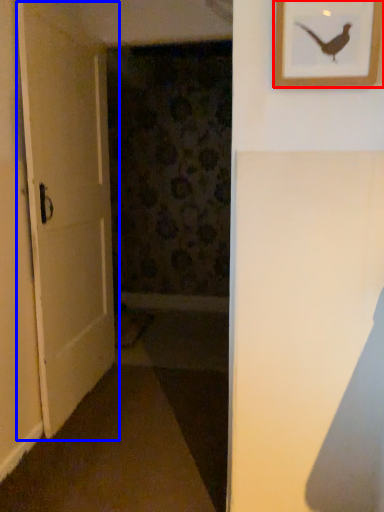
Question: Among these objects, which one is farthest to the camera, picture frame (highlighted by a red box) or door (highlighted by a blue box)?

Choices:
 (A) picture frame
 (B) door

Answer: (B)